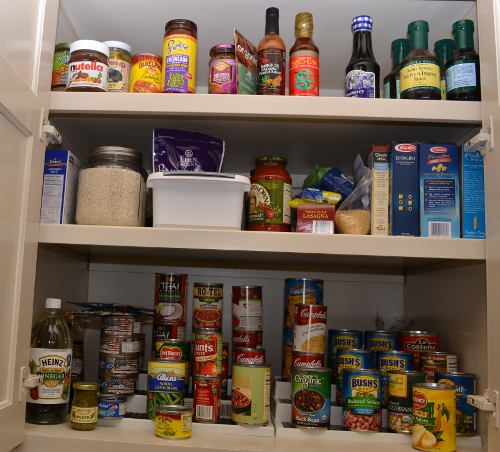
This screenshot has height=452, width=500. Identify the location of bottles. (56, 352), (469, 61), (443, 49), (420, 49), (396, 48), (361, 58), (306, 66), (269, 70).